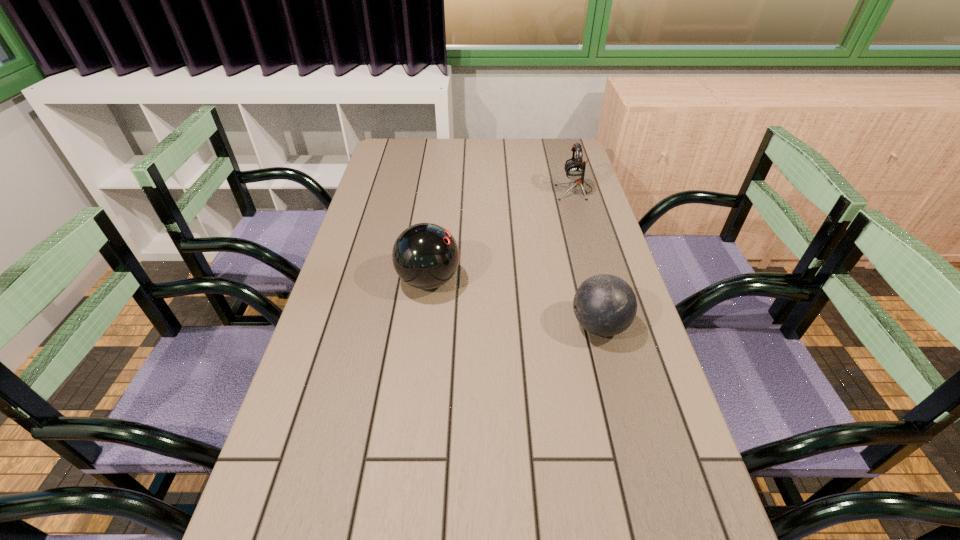
The height and width of the screenshot is (540, 960). Find the location of `free space between the farther bowling ball and the farthest object`. free space between the farther bowling ball and the farthest object is located at coordinates (501, 235).

This screenshot has width=960, height=540. Find the location of `vacant area that lies between the shorter bowling ball and the left bowling ball`. vacant area that lies between the shorter bowling ball and the left bowling ball is located at coordinates (x=514, y=303).

Locate an element on the screen. object that is the closest to the farther bowling ball is located at coordinates (605, 305).

Locate an element on the screen. The image size is (960, 540). object that is the closest one to the farthest object is located at coordinates (425, 255).

I want to click on vacant area in the image that satisfies the following two spatial constraints: 1. on the front side of the farthest object; 2. on the grip area of the right bowling ball, so click(x=613, y=326).

The height and width of the screenshot is (540, 960). Identify the location of vacant space that satisfies the following two spatial constraints: 1. on the front side of the earphone; 2. on the surface of the second nearest object near the finger holes. pyautogui.click(x=600, y=280).

The width and height of the screenshot is (960, 540). I want to click on vacant area in the image that satisfies the following two spatial constraints: 1. on the front side of the earphone; 2. on the grip area of the nearer bowling ball, so coord(613,326).